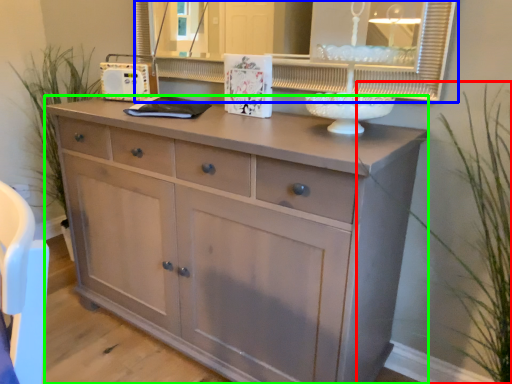
Question: Estimate the real-world distances between objects in this image. Which object is closer to plant (highlighted by a red box), medicine cabinet (highlighted by a blue box) or chest of drawers (highlighted by a green box)?

Choices:
 (A) medicine cabinet
 (B) chest of drawers

Answer: (A)